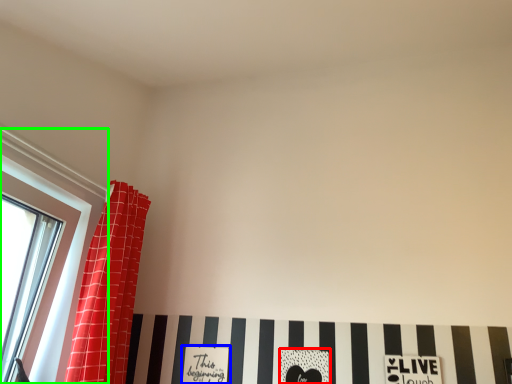
Question: Estimate the real-world distances between objects in this image. Which object is farther from print (highlighted by a red box), print (highlighted by a blue box) or window (highlighted by a green box)?

Choices:
 (A) print
 (B) window

Answer: (B)